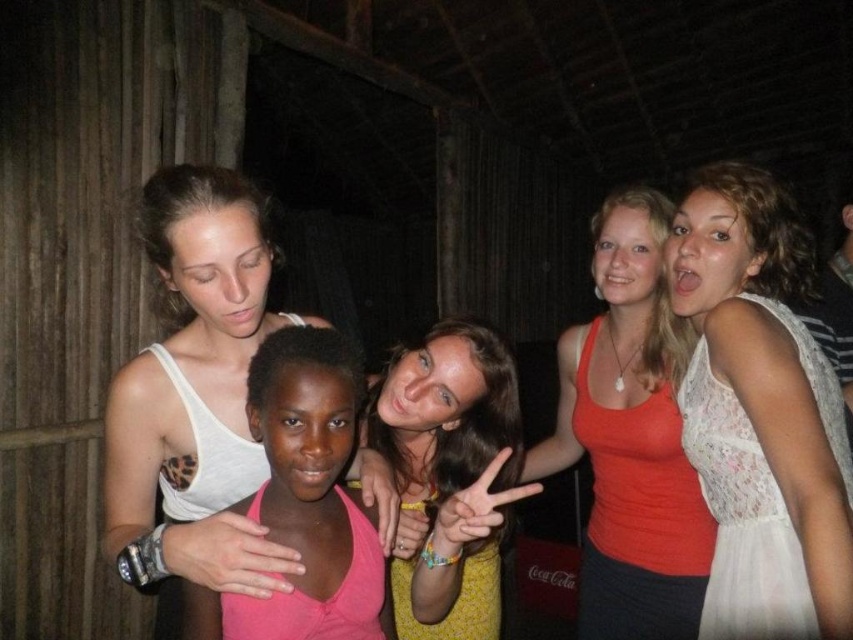
Does white lace dress at center have a greater height compared to matte orange tank top at center?

Incorrect, white lace dress at center's height is not larger of matte orange tank top at center's.

Which is behind, point (792, 368) or point (561, 378)?

Positioned behind is point (561, 378).

Between point (699, 225) and point (643, 342), which one is positioned in front?

Point (699, 225) is more forward.

I want to click on white lace dress at center, so click(759, 413).

From the picture: Does matte orange tank top at center appear over yellowmaterialshirt at center?

Yes.

Find the location of a particular element. The height and width of the screenshot is (640, 853). matte orange tank top at center is located at coordinates (631, 436).

At what (x,y) coordinates should I click in order to perform the action: click on matte orange tank top at center. Please return your answer as a coordinate pair (x, y). This screenshot has height=640, width=853. Looking at the image, I should click on (631, 436).

Is point (750, 474) positioned after point (251, 422)?

Yes, it is behind point (251, 422).

Does white lace dress at center have a lesser width compared to pink matte tank top at center?

Correct, white lace dress at center's width is less than pink matte tank top at center's.

What do you see at coordinates (759, 413) in the screenshot? The width and height of the screenshot is (853, 640). I see `white lace dress at center` at bounding box center [759, 413].

This screenshot has height=640, width=853. What are the coordinates of `white lace dress at center` in the screenshot? It's located at (759, 413).